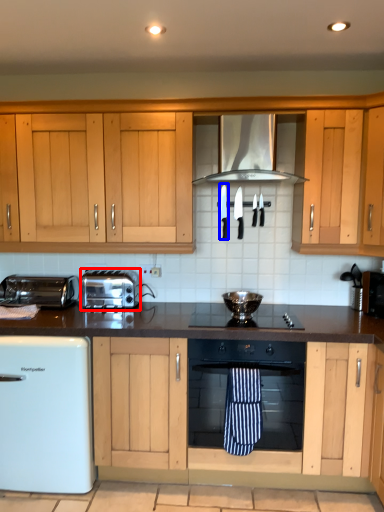
Question: Among these objects, which one is nearest to the camera, toaster (highlighted by a red box) or appliance (highlighted by a blue box)?

Choices:
 (A) toaster
 (B) appliance

Answer: (A)